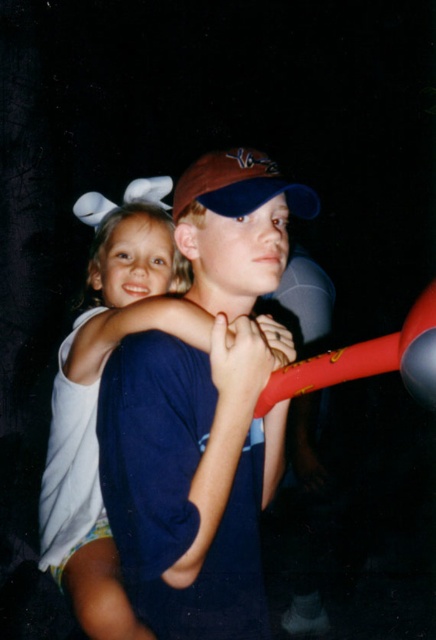
Between white cotton shirt at upper left and brown fabric baseball cap at center, which one is positioned lower?

white cotton shirt at upper left

Measure the distance between point (197, 284) and camera.

Point (197, 284) and camera are 3.88 feet apart from each other.

Is point (123, 266) behind point (241, 209)?

Yes, point (123, 266) is behind point (241, 209).

The width and height of the screenshot is (436, 640). I want to click on white cotton shirt at upper left, so click(x=96, y=400).